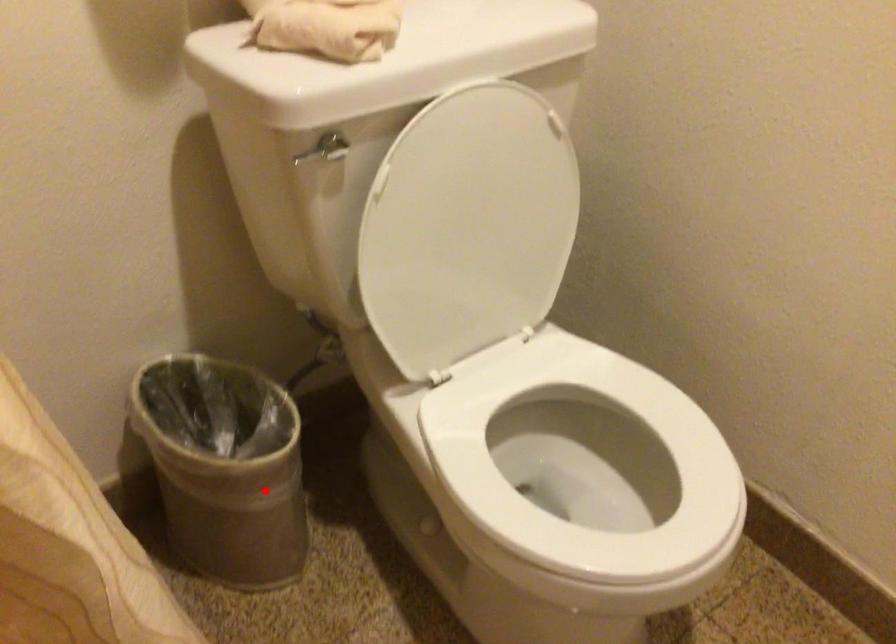
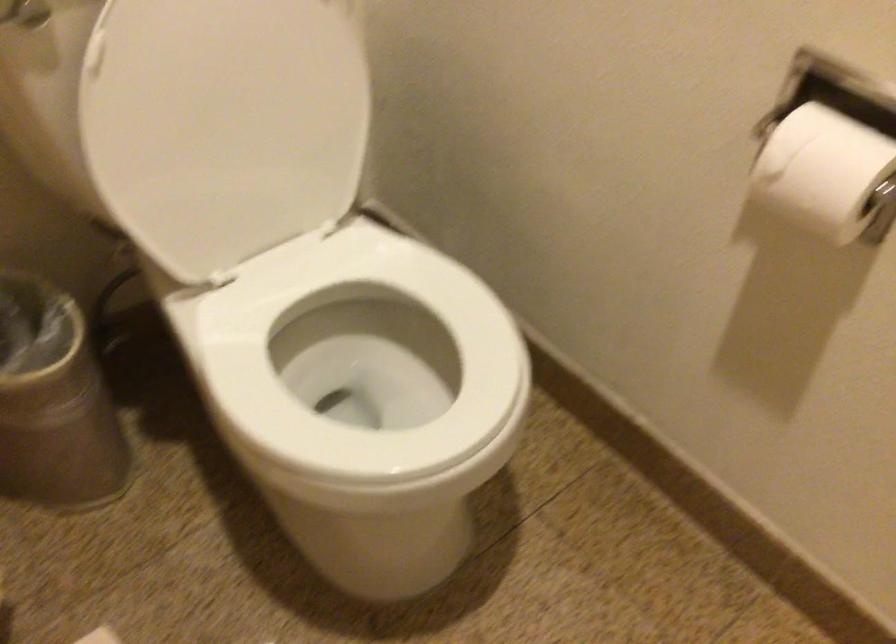
Find the pixel in the second image that matches the highlighted location in the first image.

(54, 402)